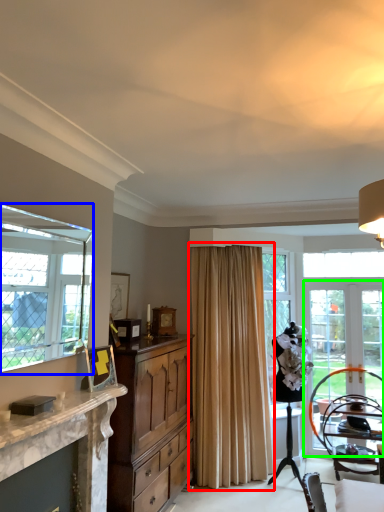
Question: Estimate the real-world distances between objects in this image. Which object is farther from curtain (highlighted by a red box), window (highlighted by a blue box) or screen door (highlighted by a green box)?

Choices:
 (A) window
 (B) screen door

Answer: (A)